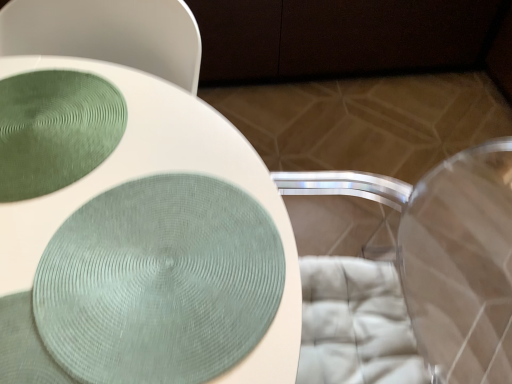
This screenshot has height=384, width=512. In order to click on empty space that is ontop of green textured glass plate at upper left (from a real-world perspective) in this screenshot , I will do `click(51, 123)`.